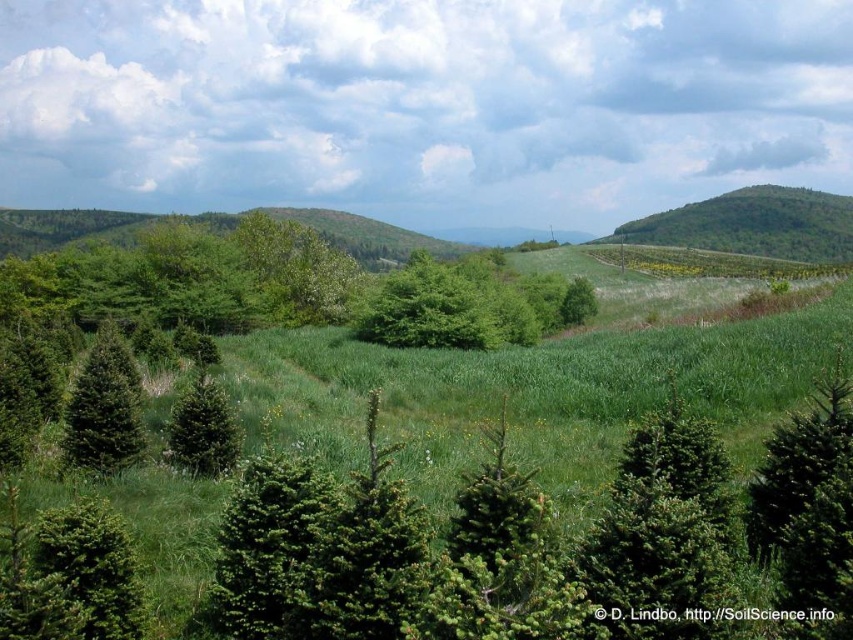
The width and height of the screenshot is (853, 640). I want to click on green leafy tree at center, so click(469, 305).

Is point (393, 321) positioned after point (65, 422)?

Yes.

This screenshot has height=640, width=853. Find the location of `green leafy tree at center`. green leafy tree at center is located at coordinates (469, 305).

Can you confirm if green leafy tree at center is positioned above green leafy hill at upper right?

No.

Is point (430, 340) more distant than point (834, 228)?

That is False.

Identify the location of green leafy tree at center. Image resolution: width=853 pixels, height=640 pixels. (469, 305).

Is green leafy hill at upper right to the right of green matte evergreen tree at left from the viewer's perspective?

Correct, you'll find green leafy hill at upper right to the right of green matte evergreen tree at left.

Is the position of green leafy hill at upper right more distant than that of green matte evergreen tree at left?

Yes.

This screenshot has height=640, width=853. What are the coordinates of `green leafy hill at upper right` in the screenshot? It's located at (752, 225).